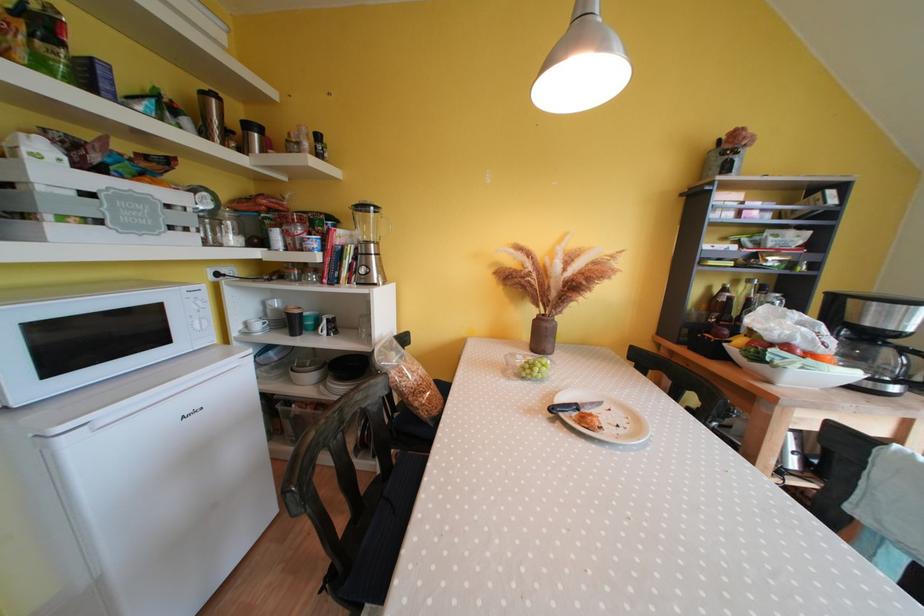
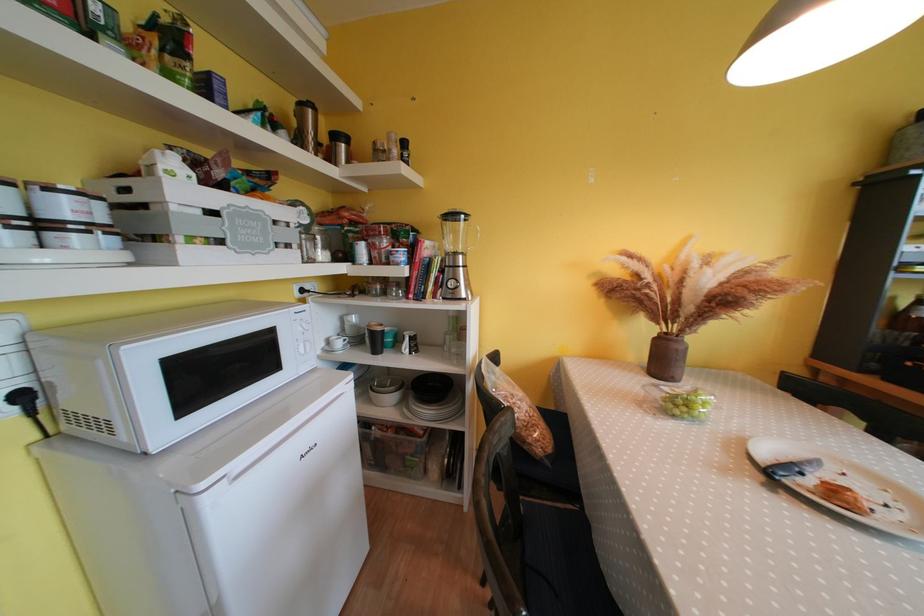
Question: The images are taken continuously from a first-person perspective. In which direction are you moving?

Choices:
 (A) Left
 (B) Right
 (C) Forward
 (D) Backward

Answer: (A)